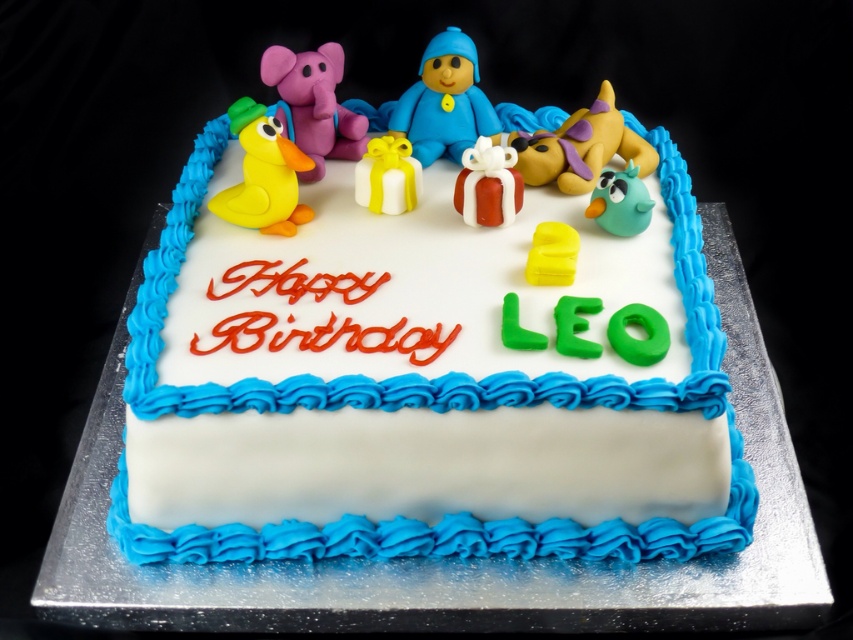
Does point (264, 125) come farther from viewer compared to point (625, 209)?

No, it is not.

Does rubber duck at upper left have a larger size compared to teal matte bird at upper right?

Yes.

This screenshot has height=640, width=853. Find the location of `rubber duck at upper left`. rubber duck at upper left is located at coordinates (263, 173).

Does white smooth frosting at bottom have a lesser width compared to blue matte figure at center?

In fact, white smooth frosting at bottom might be wider than blue matte figure at center.

Is point (152, 502) positioned before point (480, 132)?

Yes, it is.

Where is `white smooth frosting at bottom`? This screenshot has width=853, height=640. white smooth frosting at bottom is located at coordinates (426, 465).

Who is more forward, (271, 154) or (393, 166)?

Point (271, 154) is more forward.

Looking at this image, can you confirm if rubber duck at upper left is bigger than white fondant gift at center?

Yes, rubber duck at upper left is bigger than white fondant gift at center.

Which is in front, point (251, 148) or point (358, 163)?

Positioned in front is point (251, 148).

Where is `rubber duck at upper left`? This screenshot has width=853, height=640. rubber duck at upper left is located at coordinates (263, 173).